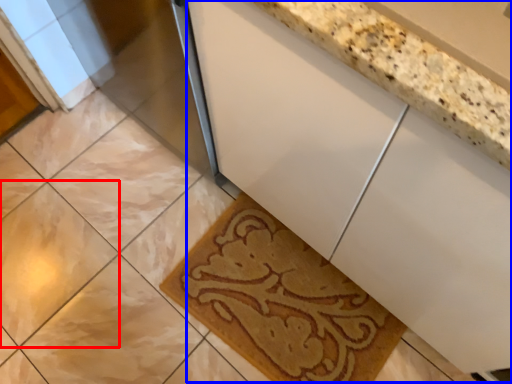
Question: Which of the following is the farthest to the observer, ceramic tile (highlighted by a red box) or counter (highlighted by a blue box)?

Choices:
 (A) ceramic tile
 (B) counter

Answer: (A)